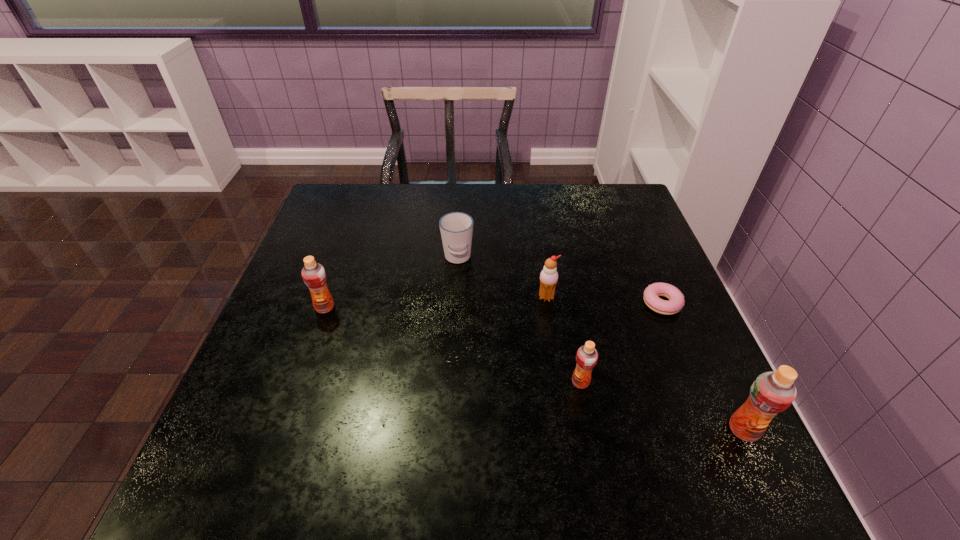
Locate which orange juice is the second closest to the fourth object from right to left. Please provide its 2D coordinates. Your answer should be formatted as a tuple, i.e. [(x, y)], where the tuple contains the x and y coordinates of a point satisfying the conditions above.

[(771, 393)]

You are a GUI agent. You are given a task and a screenshot of the screen. Output one action in this format:
    pyautogui.click(x=<x>, y=<y>)
    Task: Click on the vacant space that satisfies the following two spatial constraints: 1. at the front with a straw on the fourth object from right to left; 2. on the left side of the second nearest orange juice
    The height and width of the screenshot is (540, 960).
    Given the screenshot: What is the action you would take?
    pyautogui.click(x=560, y=382)

Identify the location of vacant area in the image that satisfies the following two spatial constraints: 1. with a handle on the side of the cup; 2. on the right side of the doughnut. (455, 303).

You are a GUI agent. You are given a task and a screenshot of the screen. Output one action in this format:
    pyautogui.click(x=<x>, y=<y>)
    Task: Click on the free point that satisfies the following two spatial constraints: 1. at the front with a straw on the tallest orange juice; 2. on the left side of the icecream
    
    Given the screenshot: What is the action you would take?
    pyautogui.click(x=566, y=430)

At what (x,y) coordinates should I click in order to perform the action: click on free spot that satisfies the following two spatial constraints: 1. at the front with a straw on the icecream; 2. on the right side of the fourth object from left to right. Please return your answer as a coordinate pair (x, y). Looking at the image, I should click on (560, 382).

Where is `free region that satisfies the following two spatial constraints: 1. at the front with a straw on the rightmost orange juice; 2. on the left side of the icecream`? This screenshot has width=960, height=540. free region that satisfies the following two spatial constraints: 1. at the front with a straw on the rightmost orange juice; 2. on the left side of the icecream is located at coordinates (566, 430).

The width and height of the screenshot is (960, 540). Identify the location of vacant space that satisfies the following two spatial constraints: 1. at the front with a straw on the icecream; 2. on the right side of the doughnut. (547, 303).